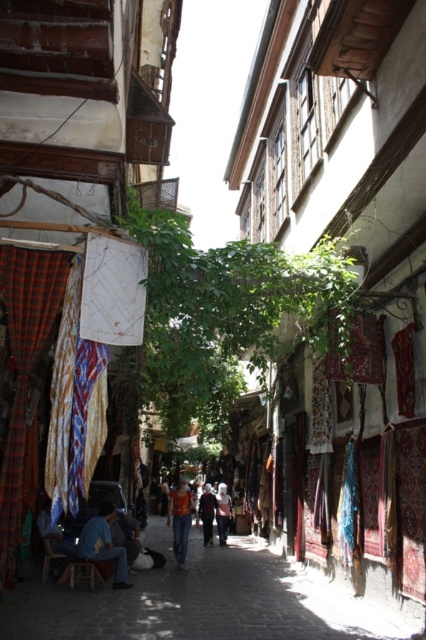
Question: Does plaid fabric curtain at left appear under light pink fabric at center?

Choices:
 (A) no
 (B) yes

Answer: (A)

Question: Estimate the real-world distances between objects in this image. Which object is closer to the matte fabric alley at center?

Choices:
 (A) light pink fabric at center
 (B) blue denim jeans at lower left
 (C) dark blue fabric at center
 (D) orange t-shirt at center

Answer: (B)

Question: Does orange t-shirt at center come in front of dark blue fabric at center?

Choices:
 (A) no
 (B) yes

Answer: (B)

Question: Can you confirm if blue denim jeans at lower left is smaller than dark blue fabric at center?

Choices:
 (A) yes
 (B) no

Answer: (B)

Question: Which of these objects is positioned closest to the blue denim jeans at lower left?

Choices:
 (A) light pink fabric at center
 (B) plaid fabric curtain at left
 (C) blue fabric at lower left

Answer: (C)

Question: Estimate the real-world distances between objects in this image. Which object is farther from the plaid fabric curtain at left?

Choices:
 (A) orange t-shirt at center
 (B) blue denim jeans at lower left

Answer: (A)